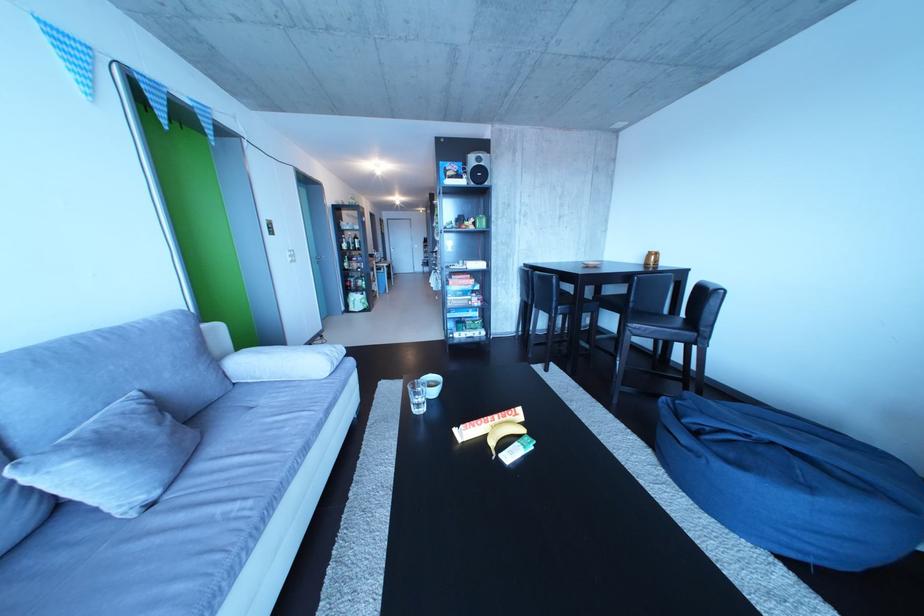
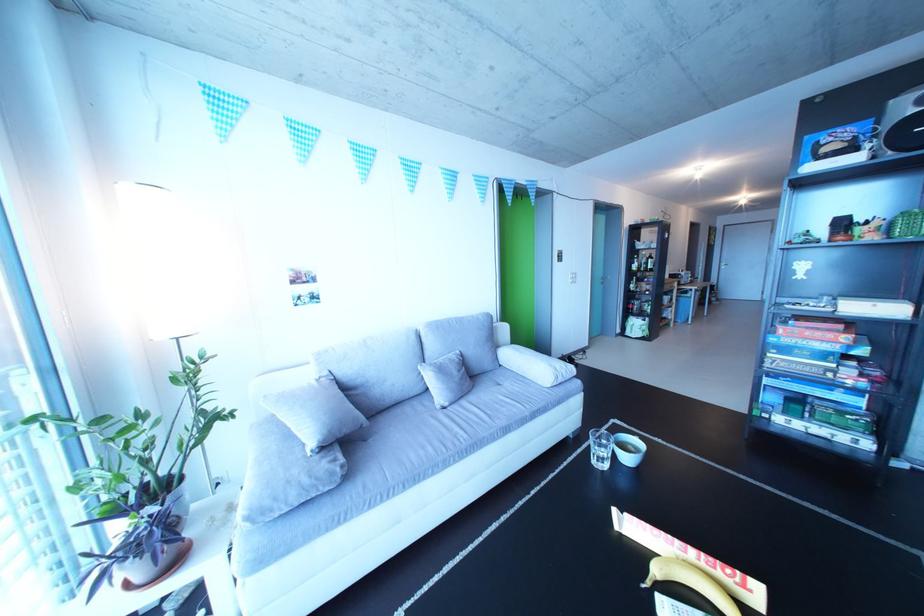
Where in the second image is the point corresponding to the point at 359,270 from the first image?

(646, 292)